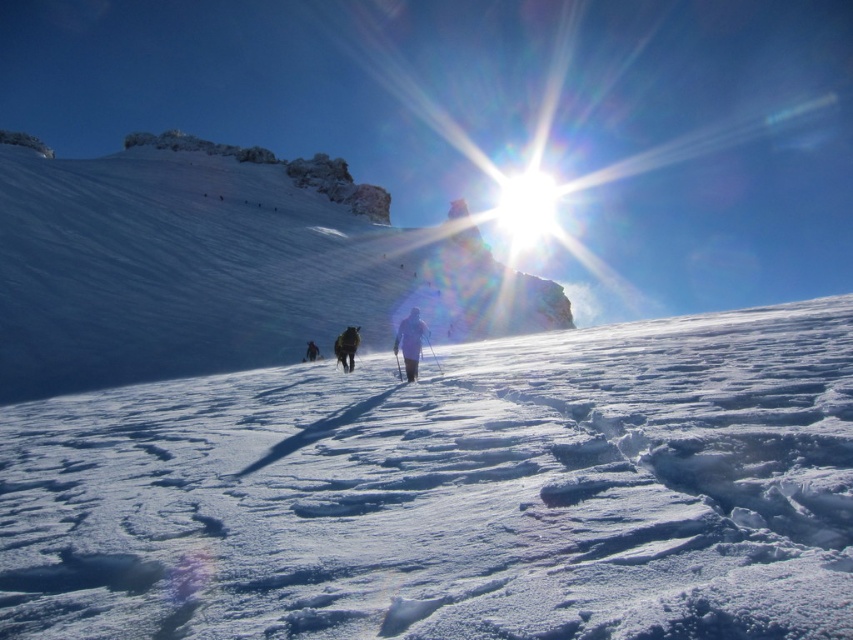
Question: Which object is farther from the camera taking this photo?

Choices:
 (A) white snow-covered mountain at upper center
 (B) dark brown fur at center
 (C) black woolen jacket at center

Answer: (B)

Question: Which object is positioned closest to the dark brown fur at center?

Choices:
 (A) white snow-covered mountain at upper center
 (B) matte black jacket at center

Answer: (B)

Question: Can you confirm if white frosty snow at center is positioned below dark brown fur at center?

Choices:
 (A) yes
 (B) no

Answer: (B)

Question: Which object is closer to the camera taking this photo?

Choices:
 (A) white frosty snow at center
 (B) matte black jacket at center

Answer: (A)

Question: Does white frosty snow at center have a smaller size compared to black woolen jacket at center?

Choices:
 (A) no
 (B) yes

Answer: (A)

Question: Can you confirm if white snow-covered mountain at upper center is thinner than matte black jacket at center?

Choices:
 (A) yes
 (B) no

Answer: (B)